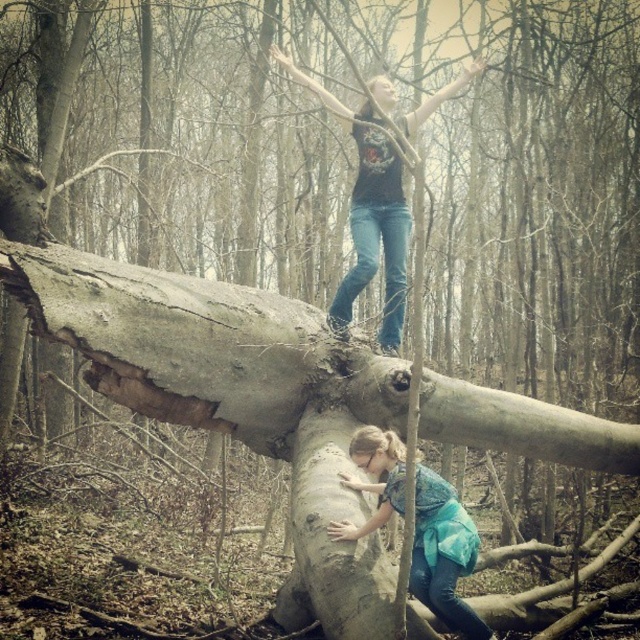
Question: Does smooth gray log at lower center lie in front of matte black shirt at upper center?

Choices:
 (A) no
 (B) yes

Answer: (B)

Question: Which object is positioned closest to the matte black shirt at upper center?

Choices:
 (A) smooth gray log at lower center
 (B) blue denim jeans at lower center

Answer: (A)

Question: From the image, what is the correct spatial relationship of matte black shirt at upper center in relation to blue denim jeans at lower center?

Choices:
 (A) left
 (B) right

Answer: (A)

Question: Among these points, which one is farthest from the camera?

Choices:
 (A) (384, 340)
 (B) (369, 518)
 (C) (339, 435)

Answer: (A)

Question: Which object is farther from the camera taking this photo?

Choices:
 (A) smooth gray log at lower center
 (B) matte black shirt at upper center
 (C) blue denim jeans at lower center

Answer: (B)

Question: Is matte black shirt at upper center above blue denim jeans at lower center?

Choices:
 (A) yes
 (B) no

Answer: (A)